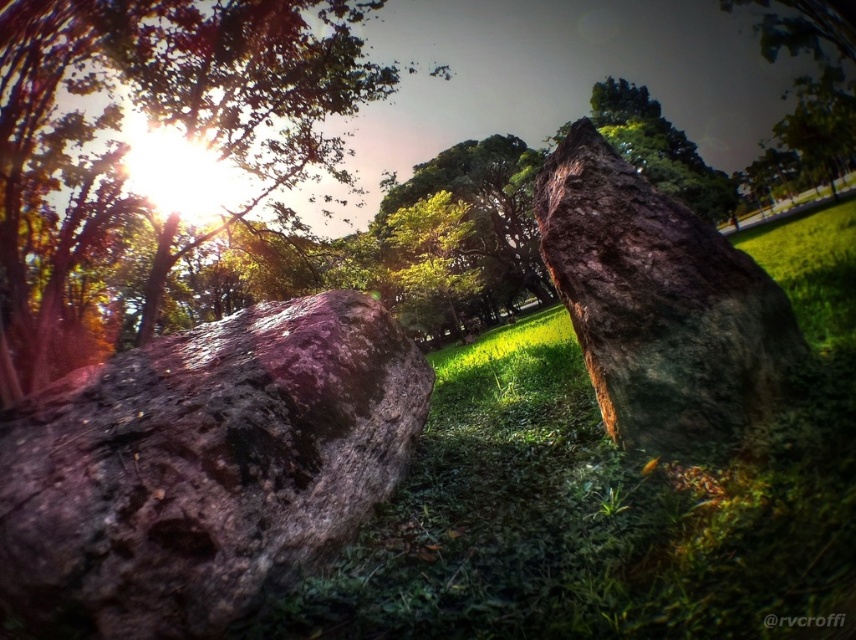
Does green grassy at center appear on the left side of green mossy rock at center?

In fact, green grassy at center is to the right of green mossy rock at center.

Is point (509, 541) positioned behind point (681, 291)?

No.

This screenshot has height=640, width=856. What are the coordinates of `green grassy at center` in the screenshot? It's located at (608, 493).

Between rusty stone boulder at lower left and smooth brown rock at left, which one appears on the right side from the viewer's perspective?

Positioned to the right is rusty stone boulder at lower left.

Does rusty stone boulder at lower left appear on the left side of smooth brown rock at left?

Incorrect, rusty stone boulder at lower left is not on the left side of smooth brown rock at left.

Locate an element on the screen. rusty stone boulder at lower left is located at coordinates (203, 467).

Which is behind, point (232, 531) or point (774, 134)?

The point (774, 134) is more distant.

Does point (60, 566) lie in front of point (800, 90)?

That is True.

Find the location of a particular element. rusty stone boulder at lower left is located at coordinates (203, 467).